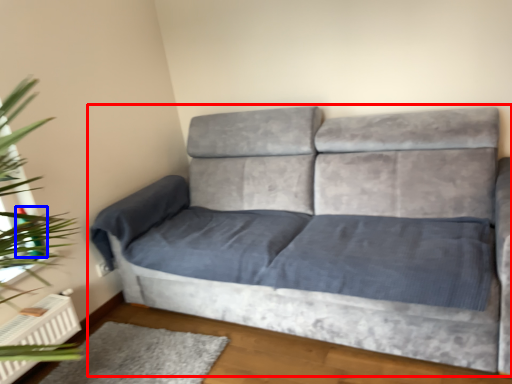
Question: Which object is further to the camera taking this photo, studio couch (highlighted by a red box) or teal (highlighted by a blue box)?

Choices:
 (A) studio couch
 (B) teal

Answer: (B)